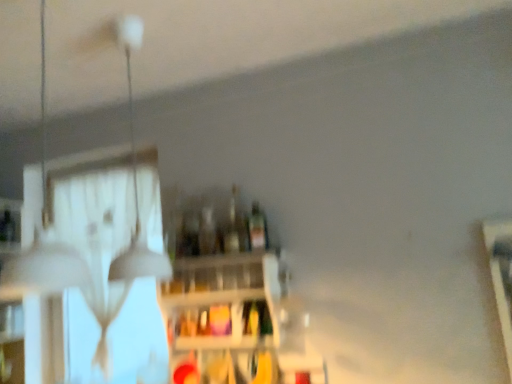
Question: Does transparent glass door at upper left come in front of white matte lampshade at upper left, which is the 2th lamp from front to back?

Choices:
 (A) no
 (B) yes

Answer: (A)

Question: Is transparent glass door at upper left at the left side of white matte lampshade at upper left, which is the 2th lamp from front to back?

Choices:
 (A) yes
 (B) no

Answer: (A)

Question: Does transparent glass door at upper left touch white matte lampshade at upper left, which is the 2th lamp from front to back?

Choices:
 (A) no
 (B) yes

Answer: (A)

Question: Does transparent glass door at upper left have a lesser width compared to white matte lampshade at upper left, which is the 2th lamp from front to back?

Choices:
 (A) no
 (B) yes

Answer: (B)

Question: From the image's perspective, is transparent glass door at upper left on white matte lampshade at upper left, the first lamp viewed from the back?

Choices:
 (A) yes
 (B) no

Answer: (B)

Question: From the image's perspective, relative to translucent glass bottle at center, the 1th bottle when ordered from left to right, is transparent glass door at upper left above or below?

Choices:
 (A) above
 (B) below

Answer: (B)

Question: From a real-world perspective, is transparent glass door at upper left physically located above or below translucent glass bottle at center, the 1th bottle when ordered from left to right?

Choices:
 (A) above
 (B) below

Answer: (B)

Question: Choose the correct answer: Is transparent glass door at upper left inside translucent glass bottle at center, the 1th bottle when ordered from left to right, or outside it?

Choices:
 (A) outside
 (B) inside

Answer: (A)

Question: Is point (118, 230) closer or farther from the camera than point (212, 226)?

Choices:
 (A) farther
 (B) closer

Answer: (A)

Question: Relative to wooden shelf at center, is transparent glass door at upper left in front or behind?

Choices:
 (A) behind
 (B) front

Answer: (A)

Question: Is transparent glass door at upper left inside or outside of wooden shelf at center?

Choices:
 (A) inside
 (B) outside

Answer: (B)

Question: From a real-world perspective, is transparent glass door at upper left positioned above or below wooden shelf at center?

Choices:
 (A) above
 (B) below

Answer: (A)

Question: In terms of size, does transparent glass door at upper left appear bigger or smaller than wooden shelf at center?

Choices:
 (A) small
 (B) big

Answer: (B)

Question: Considering the positions of white matte lampshade at upper left, the first lamp viewed from the back, and translucent glass bottle at center, which appears as the 3th bottle when viewed from the right, in the image, is white matte lampshade at upper left, the first lamp viewed from the back, bigger or smaller than translucent glass bottle at center, which appears as the 3th bottle when viewed from the right,?

Choices:
 (A) big
 (B) small

Answer: (A)

Question: In terms of height, does white matte lampshade at upper left, the first lamp viewed from the back, look taller or shorter compared to translucent glass bottle at center, the 1th bottle when ordered from left to right?

Choices:
 (A) tall
 (B) short

Answer: (A)